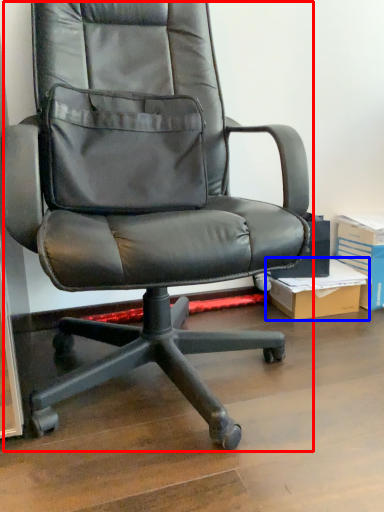
Question: Among these objects, which one is farthest to the camera, chair (highlighted by a red box) or cardboard box (highlighted by a blue box)?

Choices:
 (A) chair
 (B) cardboard box

Answer: (B)